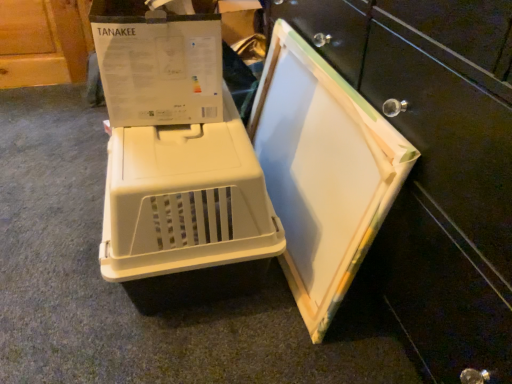
Question: Should I look upward or downward to see white cardboard at center?

Choices:
 (A) up
 (B) down

Answer: (A)

Question: Is beige plastic crate at center behind white cardboard at center?

Choices:
 (A) yes
 (B) no

Answer: (A)

Question: Is beige plastic crate at center located outside white cardboard at center?

Choices:
 (A) no
 (B) yes

Answer: (B)

Question: Is white cardboard at center completely or partially inside beige plastic crate at center?

Choices:
 (A) yes
 (B) no

Answer: (B)

Question: From a real-world perspective, is beige plastic crate at center located higher than white cardboard at center?

Choices:
 (A) yes
 (B) no

Answer: (B)

Question: Does beige plastic crate at center have a greater width compared to white cardboard at center?

Choices:
 (A) no
 (B) yes

Answer: (B)

Question: Considering the relative positions of beige plastic crate at center and white cardboard at center in the image provided, is beige plastic crate at center to the left of white cardboard at center from the viewer's perspective?

Choices:
 (A) no
 (B) yes

Answer: (B)

Question: From the image's perspective, is white cardboard at center over beige plastic crate at center?

Choices:
 (A) no
 (B) yes

Answer: (B)

Question: Is white cardboard at center wider than beige plastic crate at center?

Choices:
 (A) no
 (B) yes

Answer: (A)

Question: Considering the relative positions of white cardboard at center and beige plastic crate at center in the image provided, is white cardboard at center to the right of beige plastic crate at center from the viewer's perspective?

Choices:
 (A) no
 (B) yes

Answer: (B)

Question: From the image's perspective, is white cardboard at center beneath beige plastic crate at center?

Choices:
 (A) no
 (B) yes

Answer: (A)

Question: From a real-world perspective, is white cardboard at center positioned over beige plastic crate at center based on gravity?

Choices:
 (A) no
 (B) yes

Answer: (B)

Question: Are white cardboard at center and beige plastic crate at center far apart?

Choices:
 (A) no
 (B) yes

Answer: (A)

Question: In terms of width, does beige plastic crate at center look wider or thinner when compared to white cardboard at center?

Choices:
 (A) wide
 (B) thin

Answer: (A)